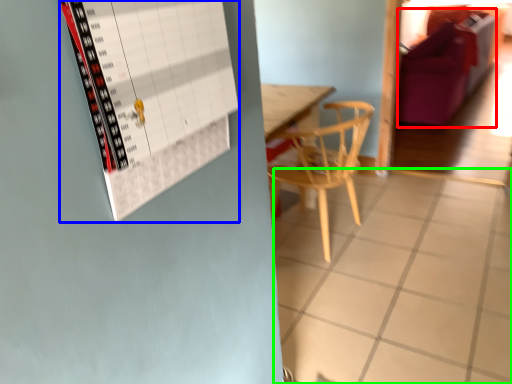
Question: Based on their relative distances, which object is farther from couch (highlighted by a red box)? Choose from bulletin board (highlighted by a blue box) and tile (highlighted by a green box).

Choices:
 (A) bulletin board
 (B) tile

Answer: (A)